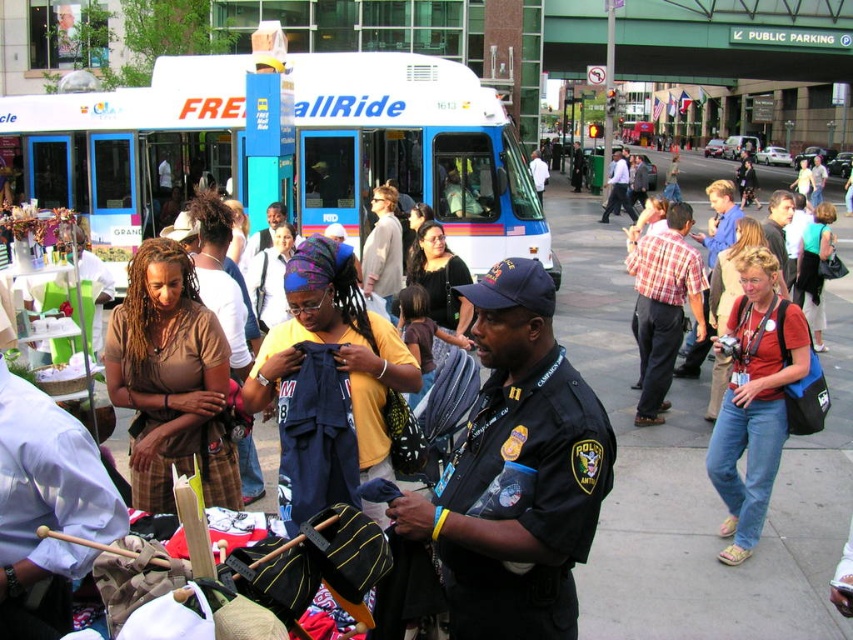
Question: Is white plastic bus at center positioned behind red shirt at center?

Choices:
 (A) no
 (B) yes

Answer: (B)

Question: Can you confirm if yellow cotton shirt at center is wider than plaid shirt at center?

Choices:
 (A) no
 (B) yes

Answer: (B)

Question: Which point appears farthest from the camera in this image?

Choices:
 (A) (685, 282)
 (B) (766, 266)

Answer: (A)

Question: Which of the following is the farthest from the observer?

Choices:
 (A) click(x=717, y=468)
 (B) click(x=527, y=419)
 (C) click(x=358, y=312)
 (D) click(x=231, y=452)

Answer: (A)

Question: Where is yellow cotton shirt at center located in relation to plaid shirt at center in the image?

Choices:
 (A) below
 (B) above

Answer: (A)

Question: Among these points, which one is nearest to the camera?

Choices:
 (A) (842, 312)
 (B) (445, 188)
 (C) (165, 353)

Answer: (C)